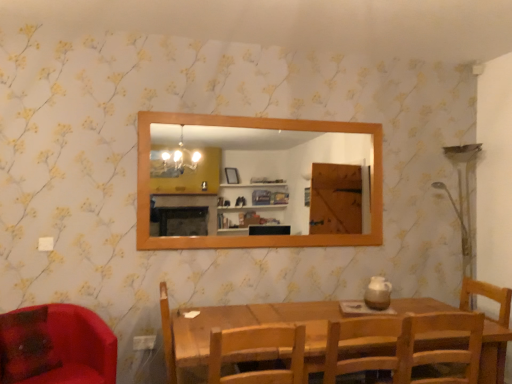
What are the coordinates of `free spot above wooden mirror at upper center (from a real-world perspective)` in the screenshot? It's located at (239, 109).